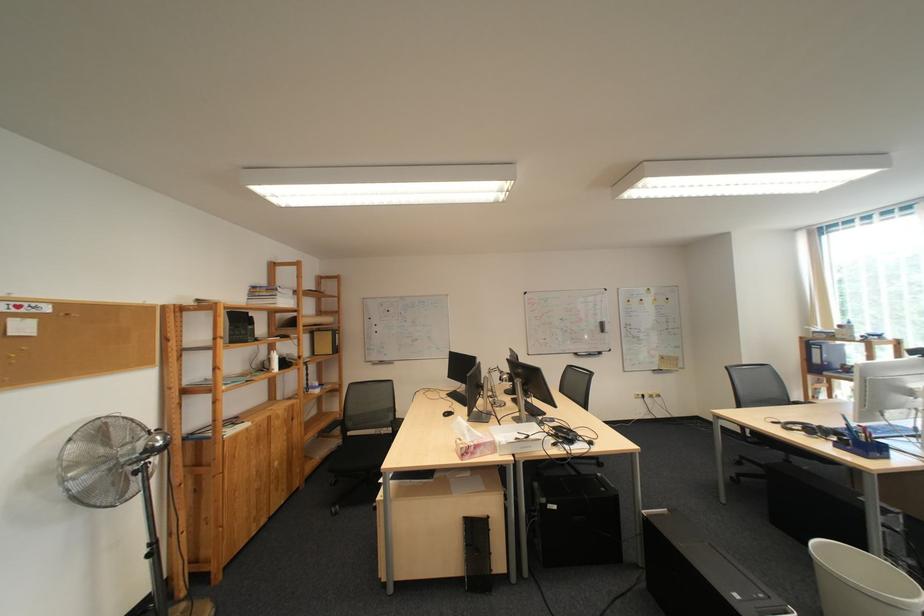
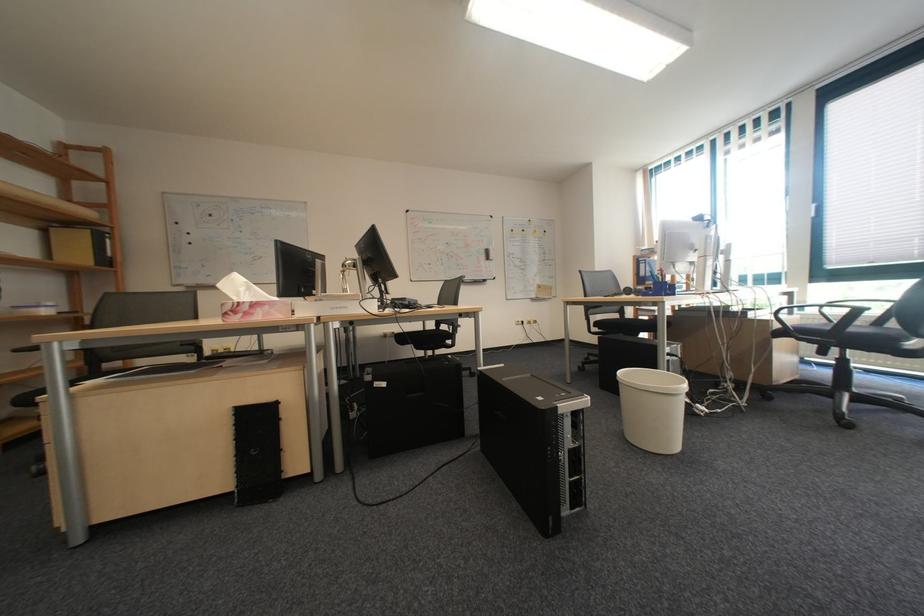
Locate, in the second image, the point that corresponds to pixel 614 462 in the first image.

(487, 371)